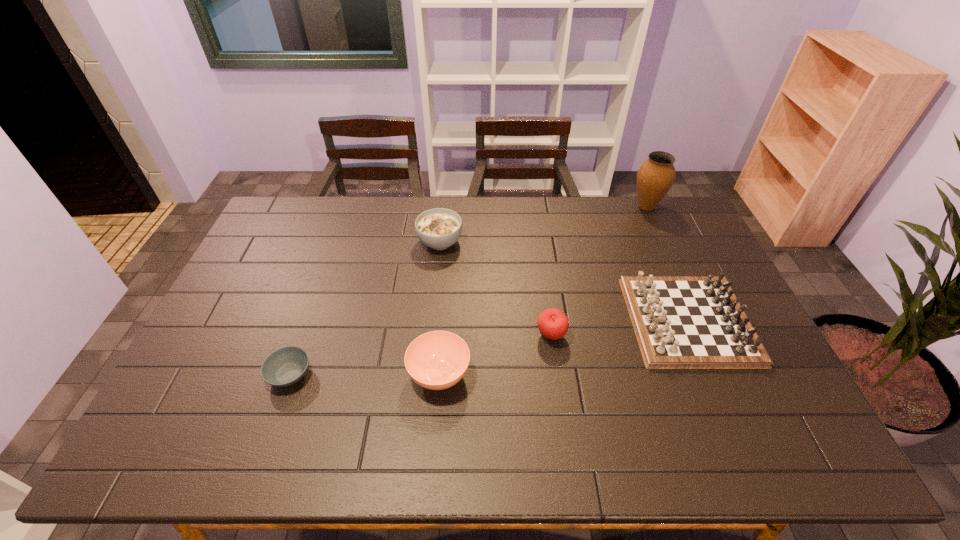
In order to click on the tallest object in this screenshot , I will do `click(656, 175)`.

Identify the location of the farthest object. (656, 175).

At what (x,y) coordinates should I click in order to perform the action: click on the farthest soup bowl. Please return your answer as a coordinate pair (x, y). The image size is (960, 540). Looking at the image, I should click on (439, 228).

Find the location of `the tallest soup bowl`. the tallest soup bowl is located at coordinates coord(439,228).

Locate an element on the screen. This screenshot has width=960, height=540. the fourth object from left to right is located at coordinates (553, 323).

Where is `chessboard`? This screenshot has width=960, height=540. chessboard is located at coordinates (681, 322).

You are a GUI agent. You are given a task and a screenshot of the screen. Output one action in this format:
    pyautogui.click(x=<x>, y=<y>)
    Task: Click on the second shortest soup bowl
    
    Given the screenshot: What is the action you would take?
    pyautogui.click(x=437, y=360)

The height and width of the screenshot is (540, 960). What are the coordinates of `the leftmost soup bowl` in the screenshot? It's located at (285, 366).

The image size is (960, 540). What are the coordinates of `the shortest soup bowl` in the screenshot? It's located at (285, 366).

This screenshot has height=540, width=960. In order to click on vacant space situated 0.060m on the left of the urn in this screenshot , I will do (x=613, y=206).